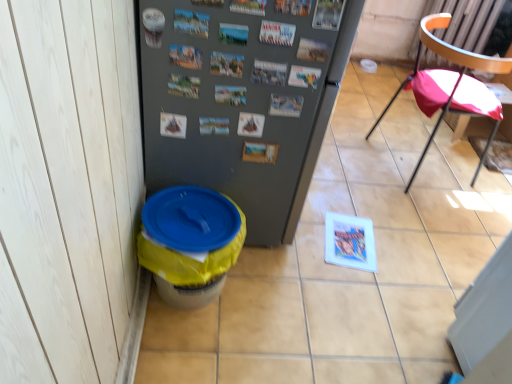
The image size is (512, 384). I want to click on spots to the right of yellow plastic potty at lower left, so click(278, 304).